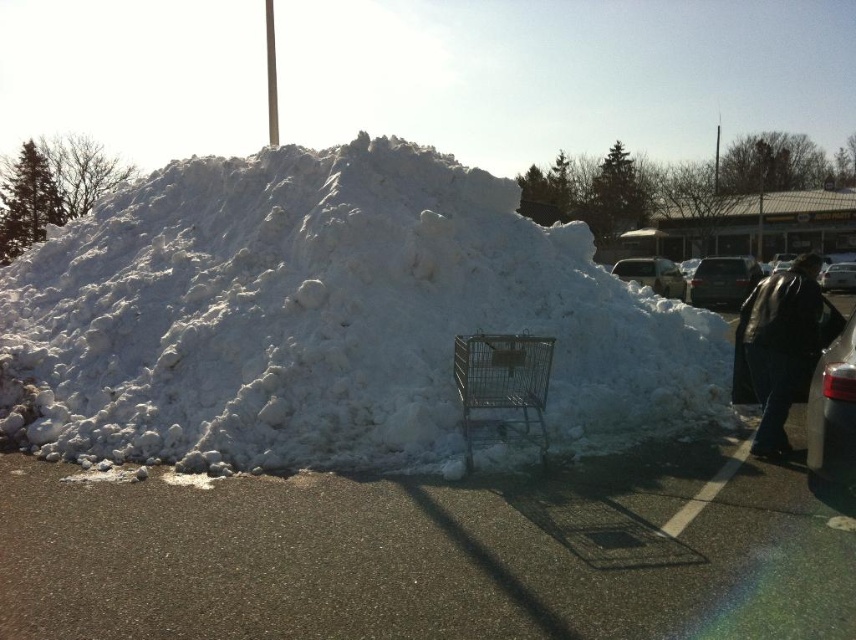
Question: Is white fluffy snow at center above silver metallic sedan at upper right?

Choices:
 (A) yes
 (B) no

Answer: (B)

Question: Which of the following is the farthest from the observer?

Choices:
 (A) matte black car at right
 (B) white fluffy snow at center
 (C) shiny silver car at right
 (D) metallic silver car at right

Answer: (A)

Question: Which of the following is the closest to the observer?

Choices:
 (A) (452, 358)
 (B) (474, 186)
 (C) (654, 291)
 (D) (839, 276)

Answer: (A)

Question: Is black leather jacket at lower right smaller than metallic silver car at right?

Choices:
 (A) no
 (B) yes

Answer: (A)

Question: Which point is farther from the camera taking this photo?

Choices:
 (A) (717, 259)
 (B) (806, 428)
 (C) (841, 320)

Answer: (A)

Question: Does white fluffy snow at center appear on the left side of metallic silver car at right?

Choices:
 (A) no
 (B) yes

Answer: (B)